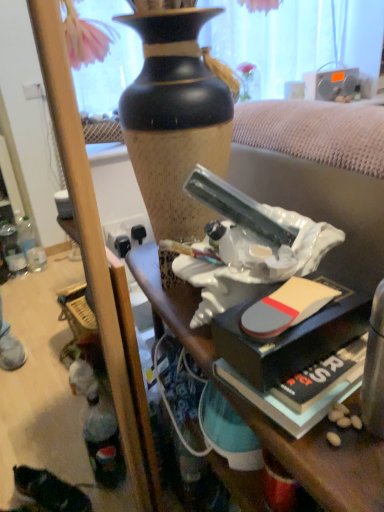
Question: Visually, is hardcover book at lower right positioned to the left or to the right of silver metallic radio at upper right?

Choices:
 (A) right
 (B) left

Answer: (B)

Question: From the image's perspective, is hardcover book at lower right above or below silver metallic radio at upper right?

Choices:
 (A) below
 (B) above

Answer: (A)

Question: Based on their relative distances, which object is nearer to the white glossy statue at center?

Choices:
 (A) hardcover book at lower right
 (B) silver metallic radio at upper right

Answer: (A)

Question: Which object is the closest to the hardcover book at lower right?

Choices:
 (A) white glossy statue at center
 (B) silver metallic radio at upper right

Answer: (A)